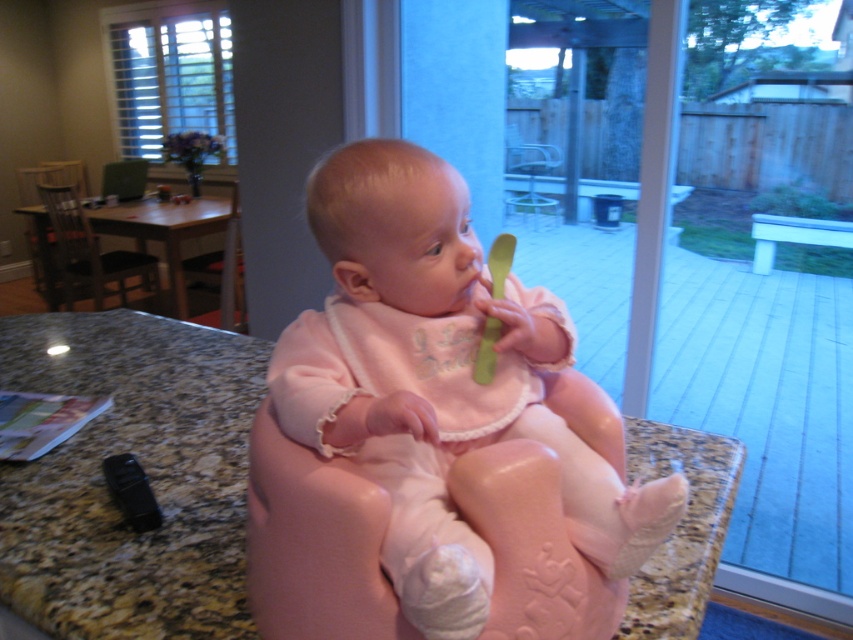
From the picture: You are a photographer setting up for a baby photoshoot. You want to capture the pink fabric baby at center in focus while keeping the background slightly blurred. Considering the baby is 53.02 centimeters away from the camera, what minimum distance should you set the camera focus to ensure the baby is sharp?

To ensure the pink fabric baby at center is in focus, set the camera focus distance to at least 53.02 centimeters, matching the baby being 53.02 centimeters away from the camera.

You are a parent trying to ensure your child is safely seated. The pink fabric baby at center is on a granite countertop at center. Is the baby positioned in a way that might be dangerous?

The pink fabric baby at center is located above granite countertop at center, which means the baby is not seated safely on the countertop but is instead positioned above it, possibly at risk of falling. This is a dangerous situation and the baby should be moved to a safer location immediately.